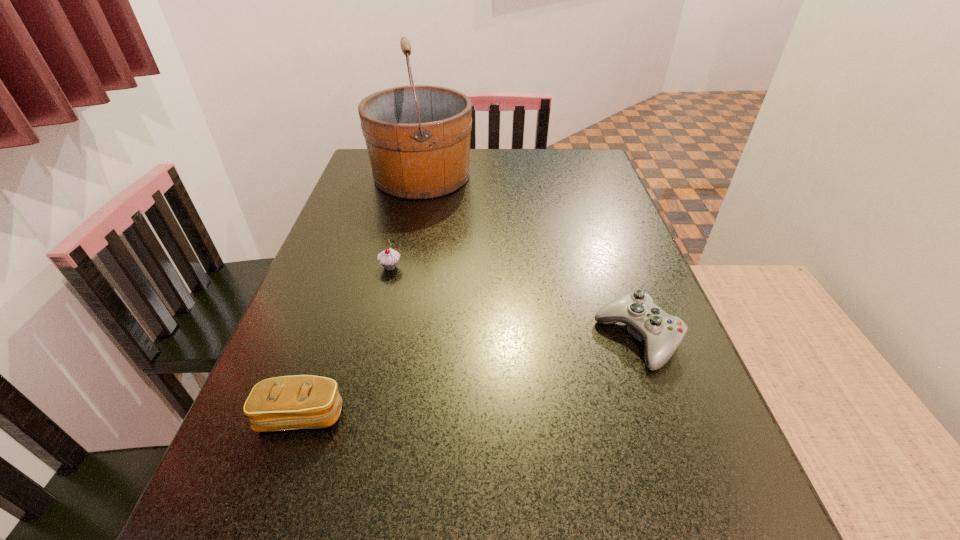
Locate an element on the screen. bucket is located at coordinates (418, 137).

The image size is (960, 540). Identify the location of the tallest object. (418, 137).

At what (x,y) coordinates should I click in order to perform the action: click on cupcake. Please return your answer as a coordinate pair (x, y). The height and width of the screenshot is (540, 960). Looking at the image, I should click on (388, 258).

Identify the location of clutch bag. (302, 401).

This screenshot has width=960, height=540. I want to click on the second nearest object, so click(662, 333).

Identify the location of control. (662, 333).

The height and width of the screenshot is (540, 960). In order to click on vacant space located on the right of the bucket in this screenshot , I will do `click(564, 176)`.

The width and height of the screenshot is (960, 540). I want to click on free space located 0.060m on the back of the cupcake, so [x=396, y=245].

Where is `free space located on the zipper side of the nearest object`? free space located on the zipper side of the nearest object is located at coordinates (274, 496).

What are the coordinates of `vacant space located 0.130m on the back of the control` in the screenshot? It's located at (613, 269).